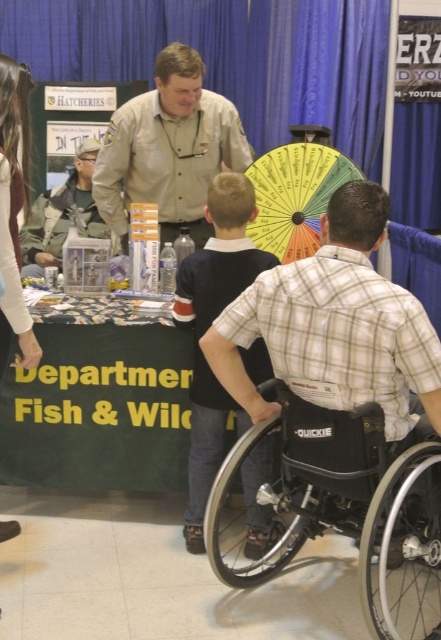
Question: Which point appears farthest from the camera in this image?

Choices:
 (A) (86, 358)
 (B) (239, 385)
 (C) (373, 444)

Answer: (A)

Question: Does plaid fabric shirt at center have a smaller size compared to camouflage jacket at left?

Choices:
 (A) yes
 (B) no

Answer: (A)

Question: Is plaid cotton shirt at center below white fabric at upper left?

Choices:
 (A) yes
 (B) no

Answer: (A)

Question: Can you confirm if black plastic wheelchair at lower center is positioned to the left of camouflage jacket at left?

Choices:
 (A) no
 (B) yes

Answer: (A)

Question: Among these objects, which one is farthest from the camera?

Choices:
 (A) green fabric sign at lower center
 (B) white fabric at upper left
 (C) camouflage jacket at left
 (D) black plastic wheelchair at lower center

Answer: (C)

Question: Which point appears farthest from the camera in this image?

Choices:
 (A) (189, 67)
 (B) (325, 161)
 (C) (362, 310)

Answer: (B)